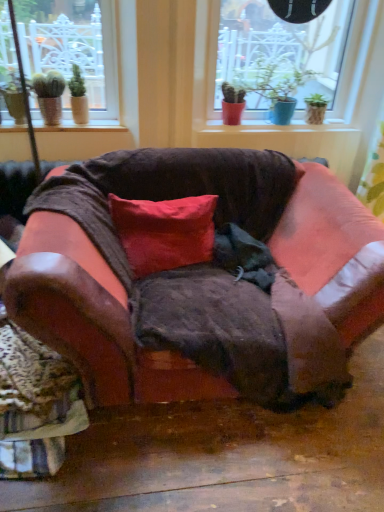
Question: Does smooth ceramic pots at center, marked as the 1th window sill in a right-to-left arrangement, have a lesser height compared to red cotton pillow at center?

Choices:
 (A) no
 (B) yes

Answer: (B)

Question: Are smooth ceramic pots at center, which ranks as the second window sill in left-to-right order, and red cotton pillow at center far apart?

Choices:
 (A) no
 (B) yes

Answer: (A)

Question: Can you confirm if smooth ceramic pots at center, which appears as the 2th window sill when viewed from the front, is thinner than red cotton pillow at center?

Choices:
 (A) yes
 (B) no

Answer: (A)

Question: From the image's perspective, is smooth ceramic pots at center, arranged as the first window sill when viewed from the back, located above red cotton pillow at center?

Choices:
 (A) no
 (B) yes

Answer: (B)

Question: From the image's perspective, is smooth ceramic pots at center, which appears as the 2th window sill when viewed from the front, under red cotton pillow at center?

Choices:
 (A) yes
 (B) no

Answer: (B)

Question: Is smooth ceramic pots at center, arranged as the first window sill when viewed from the back, positioned in front of red cotton pillow at center?

Choices:
 (A) yes
 (B) no

Answer: (B)

Question: Considering the relative sizes of red cotton pillow at center and leather-like fabric swivel chair at lower left in the image provided, is red cotton pillow at center thinner than leather-like fabric swivel chair at lower left?

Choices:
 (A) no
 (B) yes

Answer: (B)

Question: From a real-world perspective, is red cotton pillow at center on top of leather-like fabric swivel chair at lower left?

Choices:
 (A) no
 (B) yes

Answer: (B)

Question: Is red cotton pillow at center taller than leather-like fabric swivel chair at lower left?

Choices:
 (A) no
 (B) yes

Answer: (B)

Question: Could you tell me if red cotton pillow at center is turned towards leather-like fabric swivel chair at lower left?

Choices:
 (A) no
 (B) yes

Answer: (A)

Question: From the image's perspective, is red cotton pillow at center below leather-like fabric swivel chair at lower left?

Choices:
 (A) yes
 (B) no

Answer: (B)

Question: Can you confirm if red cotton pillow at center is wider than leather-like fabric swivel chair at lower left?

Choices:
 (A) no
 (B) yes

Answer: (A)

Question: Is leather couch at center inside smooth ceramic pots at center, which ranks as the second window sill in left-to-right order?

Choices:
 (A) yes
 (B) no

Answer: (B)